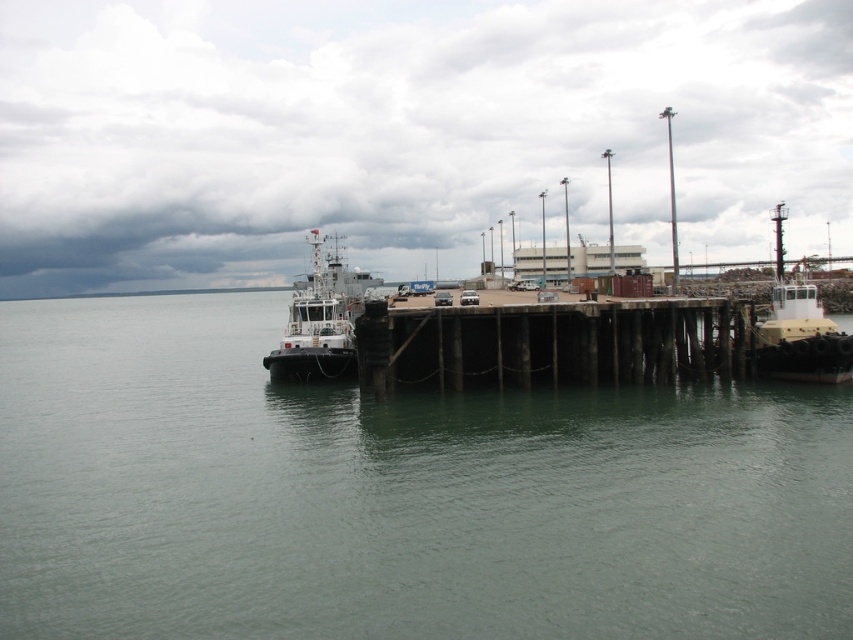
Measure the distance between greenish water at center and camera.

A distance of 26.66 feet exists between greenish water at center and camera.

Image resolution: width=853 pixels, height=640 pixels. What do you see at coordinates (395, 493) in the screenshot? I see `greenish water at center` at bounding box center [395, 493].

At what (x,y) coordinates should I click in order to perform the action: click on greenish water at center. Please return your answer as a coordinate pair (x, y). Looking at the image, I should click on (395, 493).

Does brown wooden dock at center have a lesser width compared to white glossy tugboat at left?

Yes, brown wooden dock at center is thinner than white glossy tugboat at left.

Looking at this image, does brown wooden dock at center appear on the right side of white glossy tugboat at left?

Indeed, brown wooden dock at center is positioned on the right side of white glossy tugboat at left.

I want to click on brown wooden dock at center, so click(550, 344).

Is greenish water at center taller than brown wooden dock at center?

Indeed, greenish water at center has a greater height compared to brown wooden dock at center.

Can you confirm if greenish water at center is shorter than brown wooden dock at center?

In fact, greenish water at center may be taller than brown wooden dock at center.

Image resolution: width=853 pixels, height=640 pixels. What do you see at coordinates (395, 493) in the screenshot? I see `greenish water at center` at bounding box center [395, 493].

Identify the location of greenish water at center. This screenshot has width=853, height=640. (395, 493).